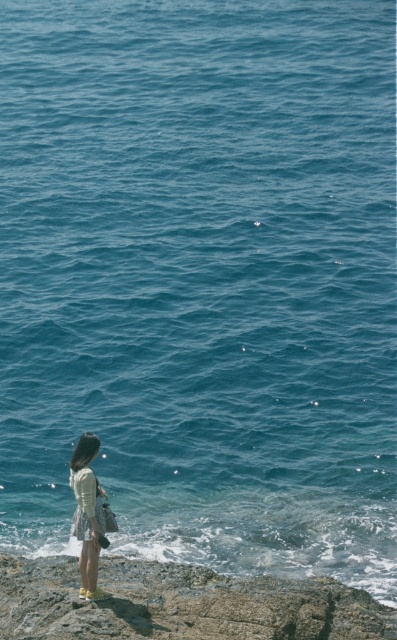
Question: Which of the following is the closest to the observer?

Choices:
 (A) white cotton dress at lower left
 (B) rough stone cliff at lower left

Answer: (A)

Question: Is light yellow fabric skirt at lower left behind white cotton dress at lower left?

Choices:
 (A) yes
 (B) no

Answer: (B)

Question: Observing the image, what is the correct spatial positioning of light yellow fabric skirt at lower left in reference to white cotton dress at lower left?

Choices:
 (A) above
 (B) below

Answer: (B)

Question: Can you confirm if light yellow fabric skirt at lower left is bigger than white cotton dress at lower left?

Choices:
 (A) no
 (B) yes

Answer: (B)

Question: Which object is farther from the camera taking this photo?

Choices:
 (A) light yellow fabric skirt at lower left
 (B) rough stone cliff at lower left
 (C) white cotton dress at lower left

Answer: (B)

Question: Which object is closer to the camera taking this photo?

Choices:
 (A) light yellow fabric skirt at lower left
 (B) white cotton dress at lower left

Answer: (A)